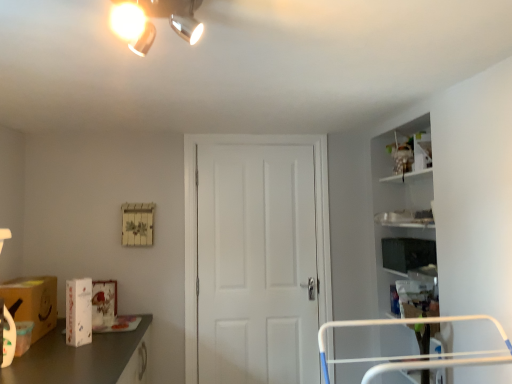
Question: Would you say white matte door at center is outside matte black tv at right, the 2th box from the bottom?

Choices:
 (A) no
 (B) yes

Answer: (B)

Question: Is white matte door at center aimed at matte black tv at right, the 2th box viewed from the front?

Choices:
 (A) yes
 (B) no

Answer: (B)

Question: Would you consider white matte door at center to be distant from matte black tv at right, which ranks as the 1th box in back-to-front order?

Choices:
 (A) yes
 (B) no

Answer: (B)

Question: Is white matte door at center positioned with its back to matte black tv at right, which ranks as the 1th box in top-to-bottom order?

Choices:
 (A) yes
 (B) no

Answer: (B)

Question: From the image's perspective, is white matte door at center on top of matte black tv at right, the 2th box from the bottom?

Choices:
 (A) no
 (B) yes

Answer: (A)

Question: Would you say matte silver light fixture at upper center is inside or outside white glossy box at lower left, the second box when ordered from back to front?

Choices:
 (A) outside
 (B) inside

Answer: (A)

Question: From a real-world perspective, is matte silver light fixture at upper center positioned above or below white glossy box at lower left, placed as the first box when sorted from left to right?

Choices:
 (A) below
 (B) above

Answer: (B)

Question: In terms of height, does matte silver light fixture at upper center look taller or shorter compared to white glossy box at lower left, arranged as the 2th box when viewed from the right?

Choices:
 (A) tall
 (B) short

Answer: (B)

Question: Considering the positions of matte silver light fixture at upper center and white glossy box at lower left, which is the 1th box from front to back, in the image, is matte silver light fixture at upper center wider or thinner than white glossy box at lower left, which is the 1th box from front to back,?

Choices:
 (A) thin
 (B) wide

Answer: (B)

Question: Is white glossy box at lower left, arranged as the 2th box when viewed from the right, wider or thinner than matte black tv at right, the 2th box viewed from the front?

Choices:
 (A) wide
 (B) thin

Answer: (B)

Question: Is point (81, 321) positioned closer to the camera than point (403, 259)?

Choices:
 (A) farther
 (B) closer

Answer: (B)

Question: From the image's perspective, is white glossy box at lower left, arranged as the 2th box when viewed from the right, located above or below matte black tv at right, the 2th box from the bottom?

Choices:
 (A) below
 (B) above

Answer: (A)

Question: From a real-world perspective, is white glossy box at lower left, the second box when ordered from back to front, physically located above or below matte black tv at right, which ranks as the 1th box in back-to-front order?

Choices:
 (A) above
 (B) below

Answer: (B)

Question: Is matte black tv at right, acting as the first box starting from the right, wider or thinner than matte brown cardboard box at lower left?

Choices:
 (A) thin
 (B) wide

Answer: (A)

Question: Considering the relative positions of matte black tv at right, the 2th box from the bottom, and matte brown cardboard box at lower left in the image provided, is matte black tv at right, the 2th box from the bottom, to the left or to the right of matte brown cardboard box at lower left?

Choices:
 (A) right
 (B) left

Answer: (A)